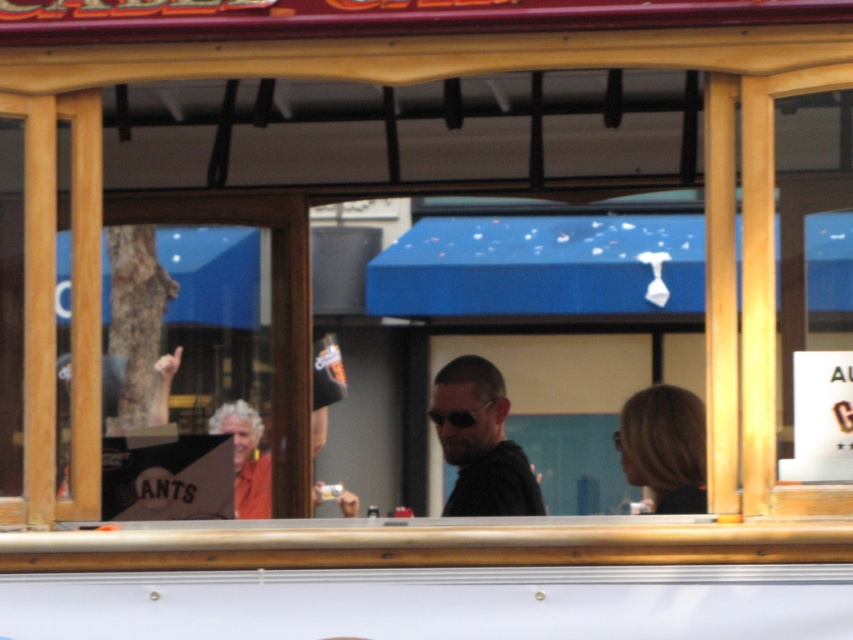
Question: Which of the following is the closest to the observer?

Choices:
 (A) blonde hair at center
 (B) sunglasses at center

Answer: (A)

Question: Is black matte sunglasses at center above blonde hair at center?

Choices:
 (A) yes
 (B) no

Answer: (B)

Question: Which object appears closest to the camera in this image?

Choices:
 (A) sunglasses at center
 (B) blonde hair at center
 (C) black matte sunglasses at center

Answer: (B)

Question: Does black matte sunglasses at center have a larger size compared to sunglasses at center?

Choices:
 (A) yes
 (B) no

Answer: (A)

Question: Which object is positioned farthest from the blonde hair at center?

Choices:
 (A) sunglasses at center
 (B) black matte sunglasses at center

Answer: (A)

Question: Can you confirm if black matte sunglasses at center is positioned below sunglasses at center?

Choices:
 (A) no
 (B) yes

Answer: (B)